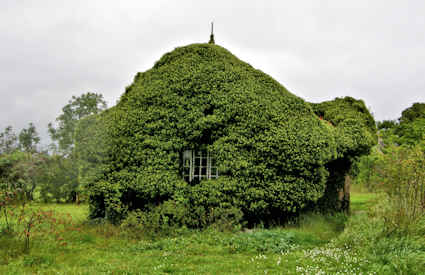
This screenshot has height=275, width=425. I want to click on white division lines in window, so click(199, 166), click(201, 174), click(208, 161), click(205, 157).